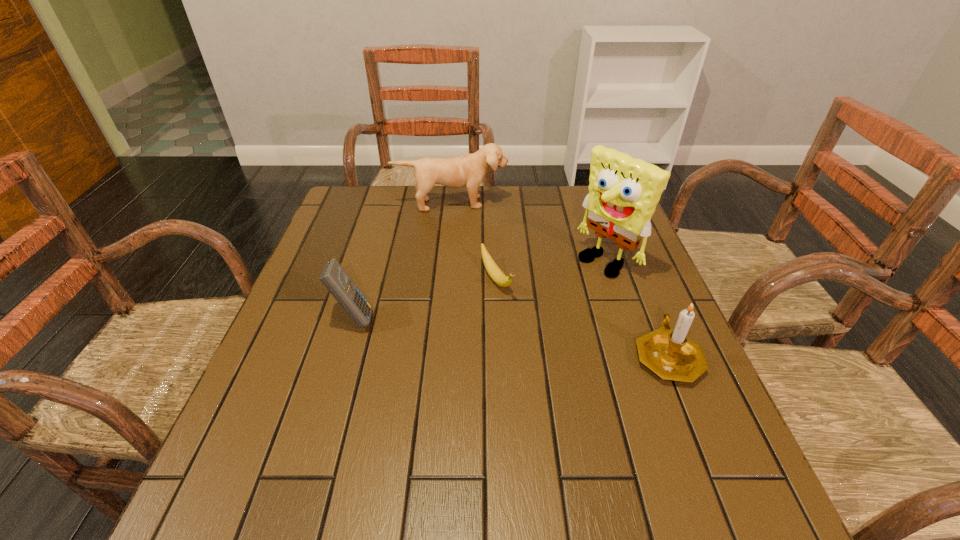
Identify the location of empty location between the calculator and the puppy. The image size is (960, 540). (403, 261).

You are a GUI agent. You are given a task and a screenshot of the screen. Output one action in this format:
    pyautogui.click(x=<x>, y=<y>)
    Task: Click on the free spot between the candle holder and the tallest object
    Image resolution: width=960 pixels, height=540 pixels.
    Given the screenshot: What is the action you would take?
    pyautogui.click(x=636, y=308)

I want to click on free spot between the farthest object and the shortest object, so click(x=474, y=241).

Where is `free space between the banana and the calculator`? free space between the banana and the calculator is located at coordinates (425, 299).

Find the location of a particular element. The height and width of the screenshot is (540, 960). free area in between the candle holder and the sponge is located at coordinates (636, 308).

This screenshot has height=540, width=960. What are the coordinates of `free spot between the candle holder and the sponge` in the screenshot? It's located at (636, 308).

You are a GUI agent. You are given a task and a screenshot of the screen. Output one action in this format:
    pyautogui.click(x=<x>, y=<y>)
    Task: Click on the vacant point located between the sponge and the farthest object
    The width and height of the screenshot is (960, 540).
    Given the screenshot: What is the action you would take?
    pyautogui.click(x=529, y=232)

Identify the location of object that is the third closest to the puppy. The height and width of the screenshot is (540, 960). (333, 276).

Locate an element on the screen. the closest object to the tallest object is located at coordinates (670, 354).

I want to click on vacant space that satisfies the following two spatial constraints: 1. on the back side of the shortest object; 2. on the right side of the tallest object, so pyautogui.click(x=495, y=261).